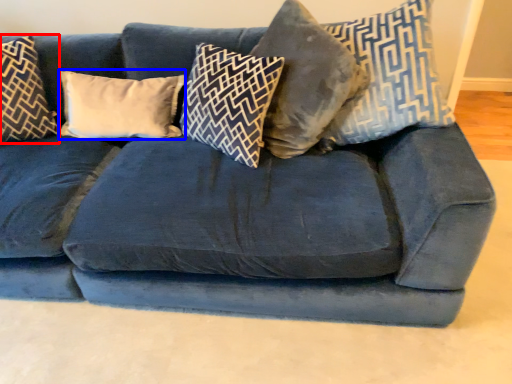
Question: Which object appears farthest to the camera in this image, pillow (highlighted by a red box) or pillow (highlighted by a blue box)?

Choices:
 (A) pillow
 (B) pillow

Answer: (B)